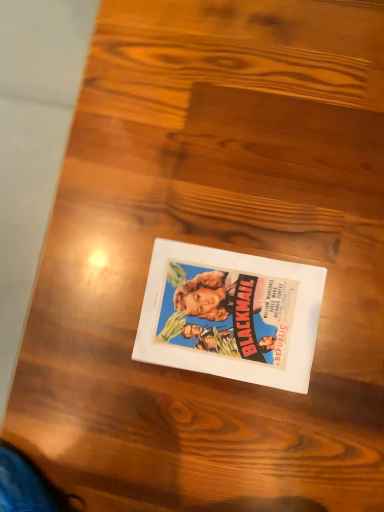
This screenshot has width=384, height=512. I want to click on vacant point to the right of matte paper book at center, so click(x=308, y=215).